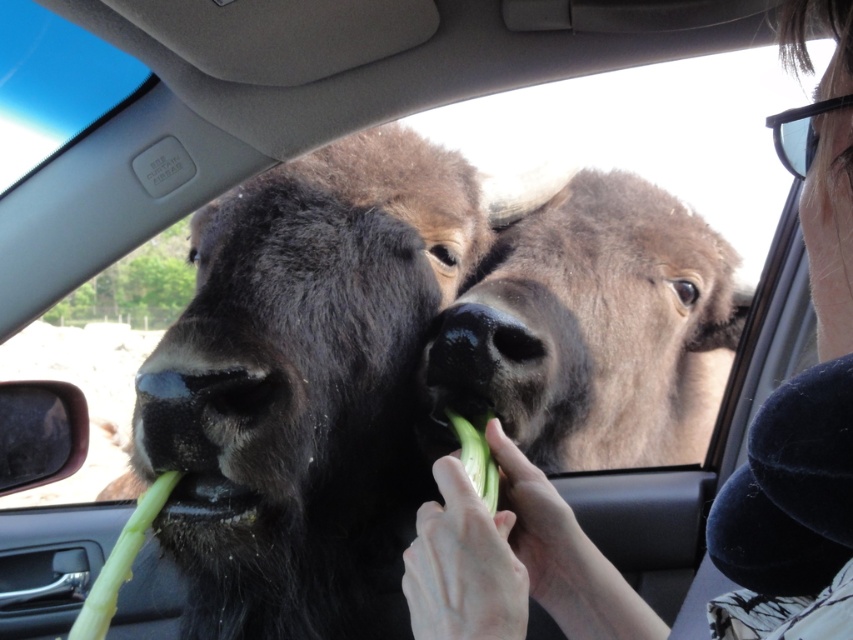
You are a zookeeper observing the interaction between the black fur yak at center and the black smooth nose at center. Which one is positioned more to the left side of the scene?

The black fur yak at center is positioned more to the left side of the scene than the black smooth nose at center.

You are a wildlife photographer trying to capture a close shot of the black fur yak at center and black smooth nose at center. What is the minimum distance you need to set your camera lens to focus on both subjects clearly?

The minimum distance your camera lens needs to be set to focus on both the black fur yak at center and the black smooth nose at center clearly is 9.12 inches, as that is the distance between them.